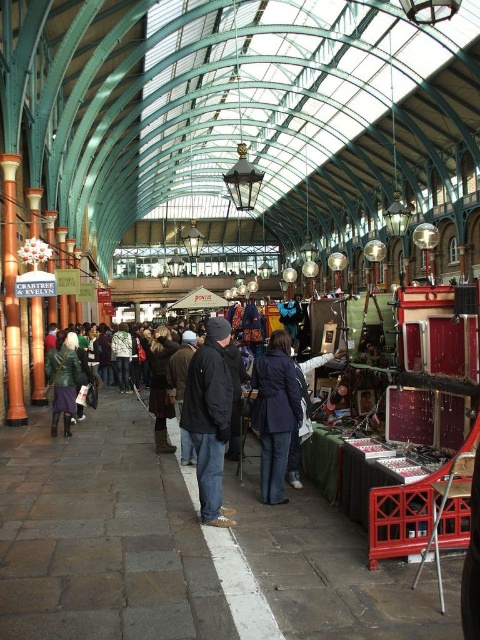
Measure the distance between navy blue fabric coat at center and camera.

navy blue fabric coat at center and camera are 29.30 meters apart from each other.

Which is above, navy blue fabric coat at center or leather jacket at center?

leather jacket at center is above.

Is point (277, 467) closer to viewer compared to point (149, 385)?

That is True.

Image resolution: width=480 pixels, height=640 pixels. I want to click on navy blue fabric coat at center, so click(x=275, y=413).

This screenshot has width=480, height=640. What do you see at coordinates (212, 419) in the screenshot? I see `dark blue jacket at center` at bounding box center [212, 419].

Is the position of dark blue jacket at center more distant than that of leather jacket at center?

No, dark blue jacket at center is closer to the viewer.

Which is in front, point (206, 323) or point (155, 376)?

Positioned in front is point (206, 323).

Identify the location of dark blue jacket at center. The height and width of the screenshot is (640, 480). (212, 419).

Is black matte jacket at center further to camera compared to navy blue fabric coat at center?

That is False.

Does point (226, 436) lie in front of point (274, 337)?

Yes, point (226, 436) is in front of point (274, 337).

At what (x,y) coordinates should I click in order to perform the action: click on black matte jacket at center. Please return your answer as a coordinate pair (x, y). Looking at the image, I should click on (210, 419).